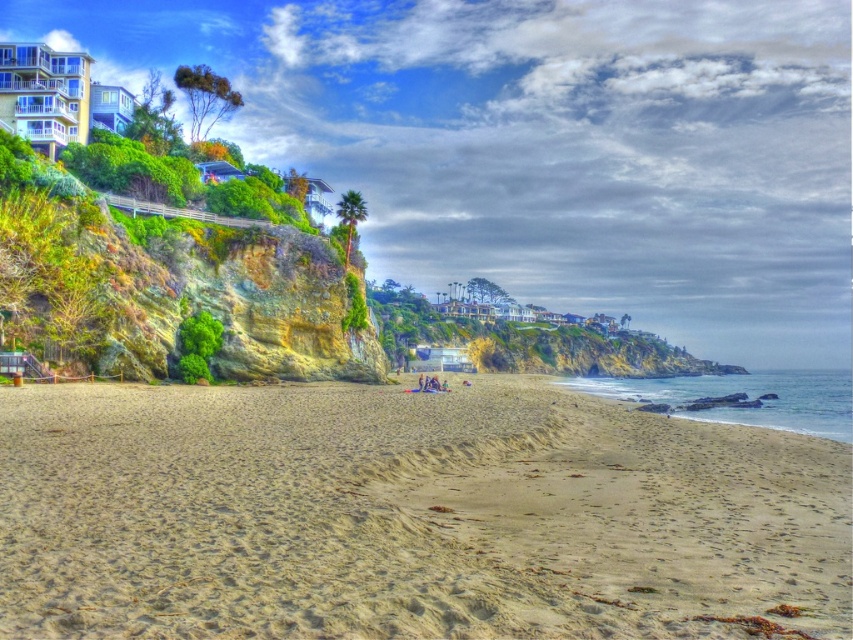
Question: Which object appears closest to the camera in this image?

Choices:
 (A) light beige sand at center
 (B) green mossy rock at upper left

Answer: (A)

Question: Is light beige sand at center below green mossy rock at upper left?

Choices:
 (A) no
 (B) yes

Answer: (B)

Question: Is light beige sand at center closer to the viewer compared to green mossy rock at upper left?

Choices:
 (A) yes
 (B) no

Answer: (A)

Question: Which object appears closest to the camera in this image?

Choices:
 (A) green mossy rock at upper left
 (B) light beige sand at center

Answer: (B)

Question: Is light beige sand at center thinner than green mossy rock at upper left?

Choices:
 (A) no
 (B) yes

Answer: (A)